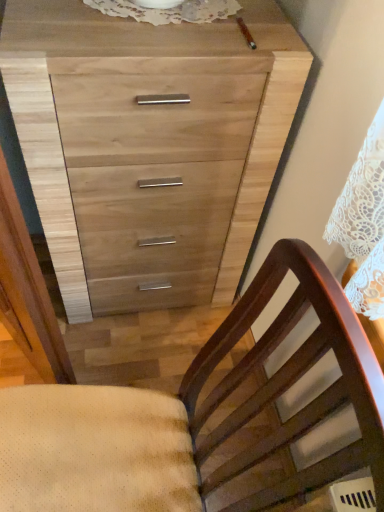
Question: From a real-world perspective, is natural wood chest of drawers at upper center beneath brown wood chair at lower right?

Choices:
 (A) yes
 (B) no

Answer: (A)

Question: Is natural wood chest of drawers at upper center outside of brown wood chair at lower right?

Choices:
 (A) no
 (B) yes

Answer: (B)

Question: Is natural wood chest of drawers at upper center behind brown wood chair at lower right?

Choices:
 (A) no
 (B) yes

Answer: (B)

Question: From a real-world perspective, does natural wood chest of drawers at upper center stand above brown wood chair at lower right?

Choices:
 (A) yes
 (B) no

Answer: (B)

Question: Is natural wood chest of drawers at upper center at the right side of brown wood chair at lower right?

Choices:
 (A) yes
 (B) no

Answer: (A)

Question: Can you confirm if natural wood chest of drawers at upper center is bigger than brown wood chair at lower right?

Choices:
 (A) yes
 (B) no

Answer: (A)

Question: From a real-world perspective, is brown wood chair at lower right positioned over natural wood chest of drawers at upper center based on gravity?

Choices:
 (A) yes
 (B) no

Answer: (A)

Question: Does brown wood chair at lower right lie in front of natural wood chest of drawers at upper center?

Choices:
 (A) no
 (B) yes

Answer: (B)

Question: Does brown wood chair at lower right lie behind natural wood chest of drawers at upper center?

Choices:
 (A) yes
 (B) no

Answer: (B)

Question: From the image's perspective, is brown wood chair at lower right below natural wood chest of drawers at upper center?

Choices:
 (A) yes
 (B) no

Answer: (A)

Question: Is brown wood chair at lower right taller than natural wood chest of drawers at upper center?

Choices:
 (A) no
 (B) yes

Answer: (B)

Question: Considering the relative sizes of brown wood chair at lower right and natural wood chest of drawers at upper center in the image provided, is brown wood chair at lower right smaller than natural wood chest of drawers at upper center?

Choices:
 (A) no
 (B) yes

Answer: (B)

Question: Choose the correct answer: Is natural wood chest of drawers at upper center inside brown wood chair at lower right or outside it?

Choices:
 (A) outside
 (B) inside

Answer: (A)